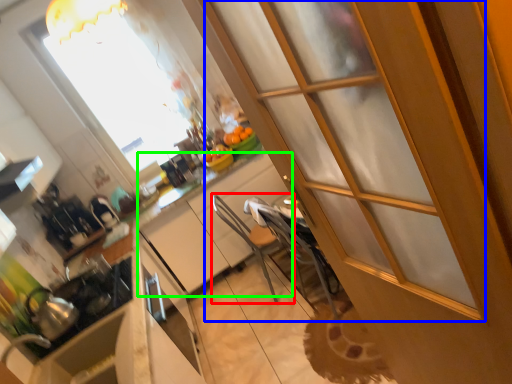
Question: Which object is positioned farthest from armchair (highlighted by a red box)? Select from screen door (highlighted by a blue box) and cabinetry (highlighted by a green box).

Choices:
 (A) screen door
 (B) cabinetry

Answer: (A)